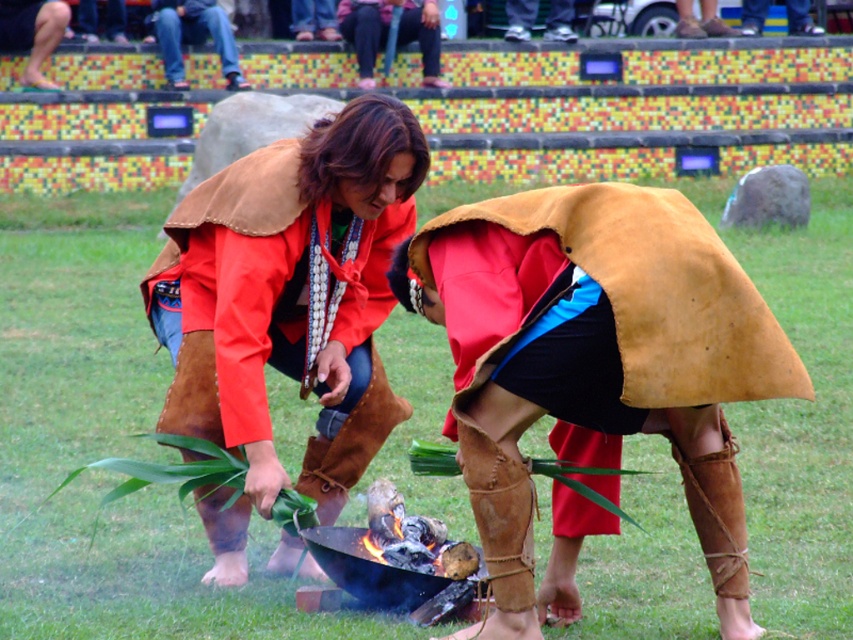
Question: Is brown leather trench coat at center further to the viewer compared to brown leather pants at center?

Choices:
 (A) yes
 (B) no

Answer: (B)

Question: Is matte red jacket at center thinner than brown leather pants at center?

Choices:
 (A) yes
 (B) no

Answer: (A)

Question: Which point appears farthest from the camera in this image?

Choices:
 (A) (374, 118)
 (B) (726, 627)

Answer: (A)

Question: Which of the following is the farthest from the observer?

Choices:
 (A) brown leather trench coat at center
 (B) matte red jacket at center

Answer: (B)

Question: Estimate the real-world distances between objects in this image. Which object is farther from the brown leather trench coat at center?

Choices:
 (A) brown leather pants at center
 (B) matte red jacket at center

Answer: (A)

Question: Observing the image, what is the correct spatial positioning of matte red jacket at center in reference to brown leather pants at center?

Choices:
 (A) right
 (B) left

Answer: (A)